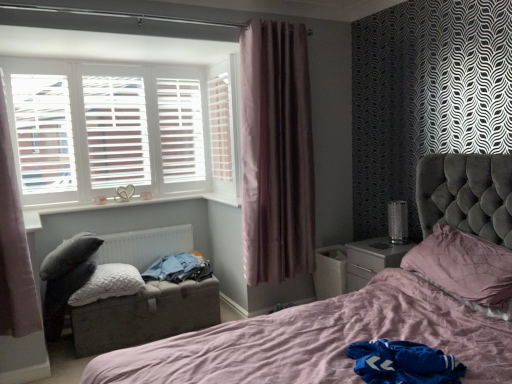
Identify the location of white wooden shutters at upper left. (122, 128).

The height and width of the screenshot is (384, 512). Identify the location of purple velvet curtain at center, which appears as the 2th curtain when viewed from the front. (276, 153).

How much space does pink satin pillow at right, arranged as the second pillow when viewed from the left, occupy horizontally?

pink satin pillow at right, arranged as the second pillow when viewed from the left, is 46.59 centimeters in width.

What do you see at coordinates (465, 268) in the screenshot? I see `pink satin pillow at right, marked as the 1th pillow in a right-to-left arrangement` at bounding box center [465, 268].

This screenshot has width=512, height=384. What do you see at coordinates (108, 284) in the screenshot? I see `white textured pillow at lower left, placed as the 1th pillow when sorted from back to front` at bounding box center [108, 284].

The width and height of the screenshot is (512, 384). What do you see at coordinates (145, 245) in the screenshot?
I see `white metallic radiator at lower left` at bounding box center [145, 245].

This screenshot has width=512, height=384. I want to click on white wooden shutters at upper left, so click(122, 128).

Considering the sizes of objects matte pink fabric bed at lower right and white glossy nightstand at lower right in the image provided, who is wider, matte pink fabric bed at lower right or white glossy nightstand at lower right?

Wider between the two is matte pink fabric bed at lower right.

Between matte pink fabric bed at lower right and white glossy nightstand at lower right, which one has larger size?

Bigger between the two is matte pink fabric bed at lower right.

Is matte pink fabric bed at lower right at the left side of white glossy nightstand at lower right?

Correct, you'll find matte pink fabric bed at lower right to the left of white glossy nightstand at lower right.

Considering the relative positions of matte pink fabric bed at lower right and white glossy nightstand at lower right in the image provided, is matte pink fabric bed at lower right in front of white glossy nightstand at lower right?

Yes, the depth of matte pink fabric bed at lower right is less than that of white glossy nightstand at lower right.

Are matte pink fabric bed at lower right and black mesh table lamp at right making contact?

matte pink fabric bed at lower right and black mesh table lamp at right are not in contact.

Is matte pink fabric bed at lower right situated inside black mesh table lamp at right or outside?

matte pink fabric bed at lower right exists outside the volume of black mesh table lamp at right.

Is matte pink fabric bed at lower right shorter than black mesh table lamp at right?

In fact, matte pink fabric bed at lower right may be taller than black mesh table lamp at right.

Does point (203, 359) come in front of point (389, 220)?

That is True.

Which is in front, point (395, 237) or point (53, 322)?

The point (395, 237) is closer to the camera.

From a real-world perspective, which object rests below the other?

dark gray fabric swivel chair at lower left, from a real-world perspective.

Is black mesh table lamp at right to the left or to the right of dark gray fabric swivel chair at lower left in the image?

black mesh table lamp at right is to the right of dark gray fabric swivel chair at lower left.

From the image's perspective, is pink fabric curtain at left, the second curtain from the back, over white glossy window sill at lower left?

Indeed, from the image's perspective, pink fabric curtain at left, the second curtain from the back, is shown above white glossy window sill at lower left.

Looking at the image, does pink fabric curtain at left, the 2th curtain in the right-to-left sequence, seem bigger or smaller compared to white glossy window sill at lower left?

pink fabric curtain at left, the 2th curtain in the right-to-left sequence, is bigger than white glossy window sill at lower left.

Is the surface of pink fabric curtain at left, positioned as the first curtain in left-to-right order, in direct contact with white glossy window sill at lower left?

They are not placed beside each other.

From a real-world perspective, which object stands above the other?

matte pink fabric bed at lower right.

Which is in front, point (61, 254) or point (511, 243)?

Positioned in front is point (511, 243).

Measure the distance between dark gray fabric swivel chair at lower left and matte pink fabric bed at lower right.

dark gray fabric swivel chair at lower left and matte pink fabric bed at lower right are 4.82 feet apart from each other.

Is dark gray fabric swivel chair at lower left shorter than matte pink fabric bed at lower right?

Indeed, dark gray fabric swivel chair at lower left has a lesser height compared to matte pink fabric bed at lower right.

Identify the location of pillow that is the 1st one when counting forward from the white metallic radiator at lower left. (108, 284).

Considering the sizes of white metallic radiator at lower left and white textured pillow at lower left, which is the 1th pillow from left to right, in the image, is white metallic radiator at lower left taller or shorter than white textured pillow at lower left, which is the 1th pillow from left to right,?

Clearly, white metallic radiator at lower left is taller compared to white textured pillow at lower left, which is the 1th pillow from left to right.

Can you confirm if white metallic radiator at lower left is positioned to the right of white textured pillow at lower left, the second pillow when ordered from front to back?

Yes.

Does dark gray fabric swivel chair at lower left have a greater width compared to white glossy nightstand at lower right?

Yes, dark gray fabric swivel chair at lower left is wider than white glossy nightstand at lower right.

From a real-world perspective, is dark gray fabric swivel chair at lower left beneath white glossy nightstand at lower right?

No.

Is point (58, 252) in front of point (371, 272)?

Yes.

Find the location of `nightstand to the right of matte pink fabric bed at lower right`. nightstand to the right of matte pink fabric bed at lower right is located at coordinates (372, 259).

The image size is (512, 384). What are the coordinates of `bed in front of the black mesh table lamp at right` in the screenshot? It's located at (321, 340).

From the image, which object appears to be farther from black mesh table lamp at right, white wood shutter at upper left or white textured pillow at lower left, placed as the 1th pillow when sorted from back to front?

Among the two, white textured pillow at lower left, placed as the 1th pillow when sorted from back to front, is located further to black mesh table lamp at right.

From the image, which object appears to be farther from white glossy nightstand at lower right, white wooden shutters at upper left or white glossy window sill at lower left?

A: Based on the image, white wooden shutters at upper left appears to be further to white glossy nightstand at lower right.

When comparing their distances from white wooden shutters at upper left, does pink satin pillow at right, marked as the 1th pillow in a right-to-left arrangement, or denim jacket at center seem closer?

Among the two, denim jacket at center is located nearer to white wooden shutters at upper left.

Estimate the real-world distances between objects in this image. Which object is further from denim jacket at center, matte gray cushioned footrest at lower left or purple velvet curtain at center, acting as the second curtain starting from the left?

Based on the image, purple velvet curtain at center, acting as the second curtain starting from the left, appears to be further to denim jacket at center.

Which object lies further to the anchor point pink satin pillow at right, which ranks as the first pillow in front-to-back order, matte gray cushioned footrest at lower left or white wood shutter at upper left?

white wood shutter at upper left.

When comparing their distances from white wooden shutters at upper left, does matte gray cushioned footrest at lower left or dark gray fabric swivel chair at lower left seem closer?

dark gray fabric swivel chair at lower left is positioned closer to the anchor white wooden shutters at upper left.

Based on their spatial positions, is white textured pillow at lower left, placed as the 1th pillow when sorted from back to front, or denim jacket at center further from white wooden shutters at upper left?

white textured pillow at lower left, placed as the 1th pillow when sorted from back to front, is positioned further to the anchor white wooden shutters at upper left.

Which object lies further to the anchor point pink fabric curtain at left, positioned as the first curtain in left-to-right order, pink satin pillow at right, which is the second pillow in back-to-front order, or matte pink fabric bed at lower right?

Based on the image, pink satin pillow at right, which is the second pillow in back-to-front order, appears to be further to pink fabric curtain at left, positioned as the first curtain in left-to-right order.

Locate an element on the screen. This screenshot has height=384, width=512. radiator between pink fabric curtain at left, the 2th curtain in the right-to-left sequence, and black mesh table lamp at right from left to right is located at coordinates (145, 245).

At what (x,y) coordinates should I click in order to perform the action: click on swivel chair located between pink fabric curtain at left, the second curtain from the back, and white glossy nightstand at lower right in the left-right direction. Please return your answer as a coordinate pair (x, y). Looking at the image, I should click on (65, 278).

Where is `clothing located between white textured pillow at lower left, marked as the second pillow in a right-to-left arrangement, and pink satin pillow at right, which ranks as the first pillow in front-to-back order, in the left-right direction`? The width and height of the screenshot is (512, 384). clothing located between white textured pillow at lower left, marked as the second pillow in a right-to-left arrangement, and pink satin pillow at right, which ranks as the first pillow in front-to-back order, in the left-right direction is located at coordinates [x=178, y=269].

Where is `window sill between white textured pillow at lower left, marked as the second pillow in a right-to-left arrangement, and pink satin pillow at right, marked as the 1th pillow in a right-to-left arrangement`? window sill between white textured pillow at lower left, marked as the second pillow in a right-to-left arrangement, and pink satin pillow at right, marked as the 1th pillow in a right-to-left arrangement is located at coordinates (136, 203).